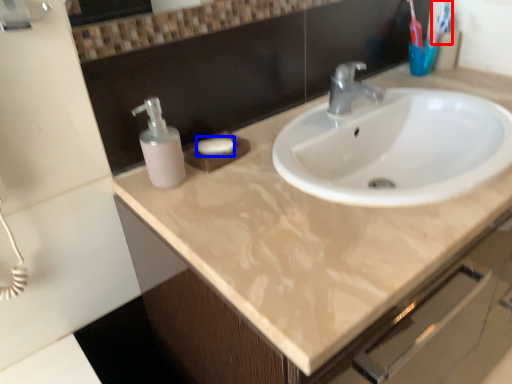
Question: Among these objects, which one is nearest to the camera, toothbrush (highlighted by a red box) or soap (highlighted by a blue box)?

Choices:
 (A) toothbrush
 (B) soap

Answer: (B)